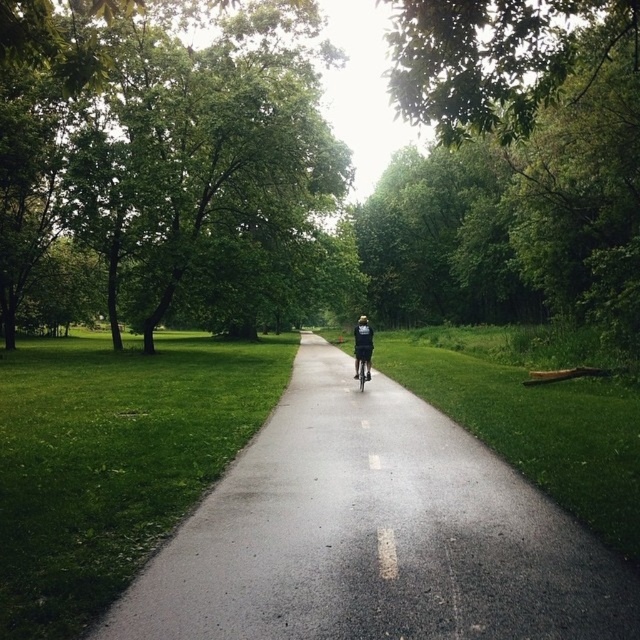
You are a pedestrian walking on the paved pathway in the park. You see a green leafy tree at center and a matte black bicycle at center. Which object is closer to the ground?

The matte black bicycle at center is closer to the ground because the green leafy tree at center is located above it.

You are a park visitor who wants to take a photo of the green leafy tree at upper left and the green leafy tree at center from the pathway. Which tree should you stand closer to in order to capture both trees in the same frame without zooming?

You should stand closer to the green leafy tree at center because it is narrower than the green leafy tree at upper left, allowing both to fit in the frame when positioned closer to the smaller tree.